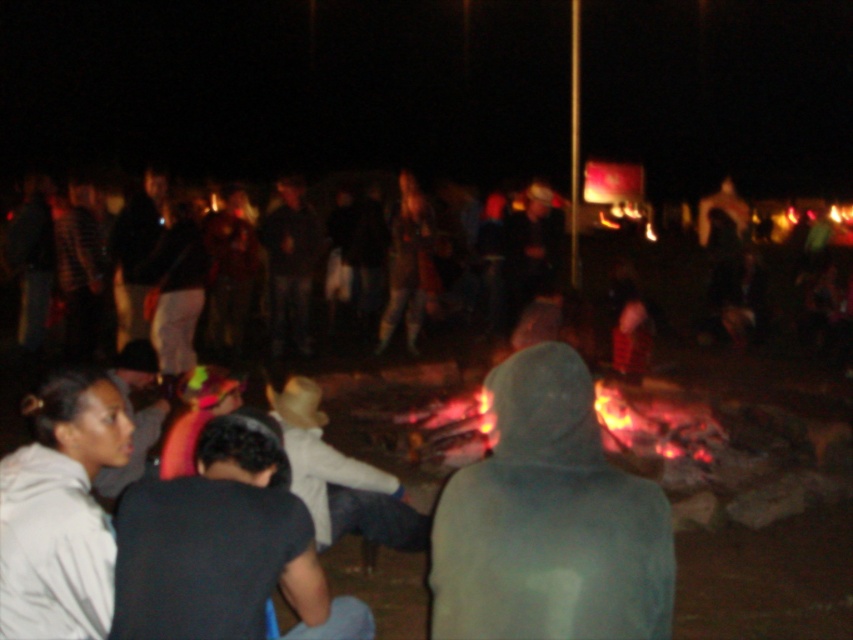
How distant is gray fleece hoodie at center from dark blue jeans at center?

The distance of gray fleece hoodie at center from dark blue jeans at center is 8.35 meters.

Is point (547, 355) closer to viewer compared to point (271, 262)?

Yes.

The image size is (853, 640). Find the location of `gray fleece hoodie at center`. gray fleece hoodie at center is located at coordinates (549, 520).

I want to click on gray fleece hoodie at center, so click(549, 520).

Does point (100, 388) come in front of point (154, 193)?

That is True.

Between point (96, 408) and point (132, 237), which one is positioned behind?

The point (132, 237) is more distant.

In the scene shown: Who is more forward, (103, 406) or (122, 224)?

Positioned in front is point (103, 406).

You are a GUI agent. You are given a task and a screenshot of the screen. Output one action in this format:
    pyautogui.click(x=<x>, y=<y>)
    Task: Click on the gray hoodie at lower left
    
    Given the screenshot: What is the action you would take?
    pyautogui.click(x=61, y=509)

Is gray hoodie at lower left closer to camera compared to light gray cotton shirt at center?

Yes, gray hoodie at lower left is closer to the viewer.

Find the location of `gray hoodie at lower left`. gray hoodie at lower left is located at coordinates (61, 509).

I want to click on gray hoodie at lower left, so click(x=61, y=509).

At what (x,y) coordinates should I click in order to perform the action: click on gray hoodie at lower left. Please return your answer as a coordinate pair (x, y). The height and width of the screenshot is (640, 853). Looking at the image, I should click on (61, 509).